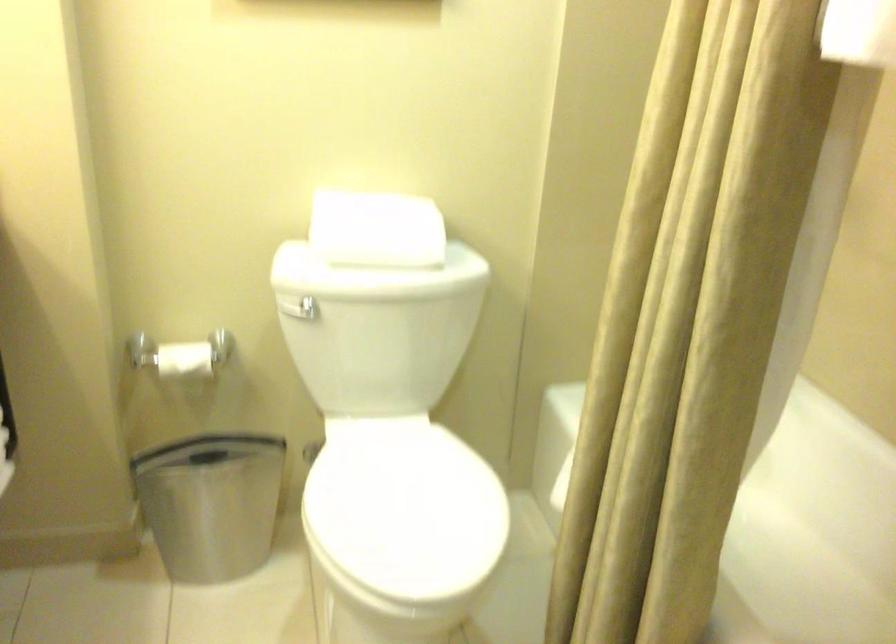
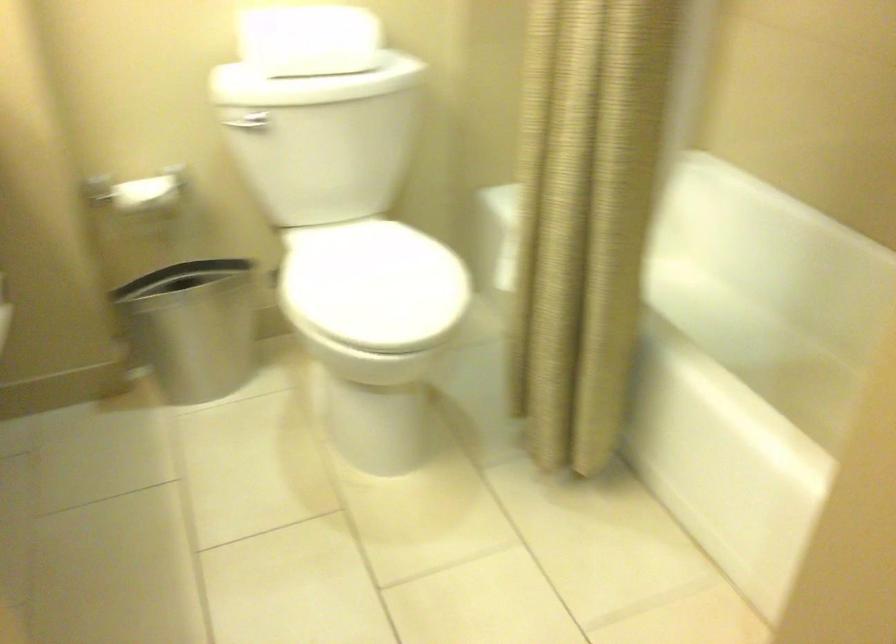
What movement of the cameraman would produce the second image?

The cameraman walked toward left, backward.